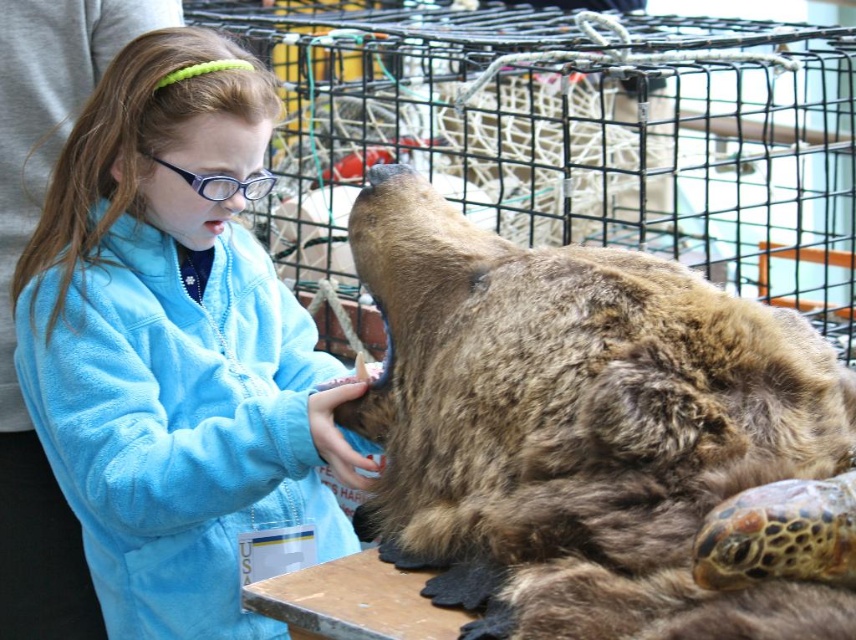
Identify the location of brown furry bear at center. The image size is (856, 640). (586, 420).

Does brown furry bear at center have a greater width compared to blue fleece jacket at upper left?

Yes.

Who is more forward, (714, 308) or (206, 588)?

Positioned in front is point (714, 308).

Locate an element on the screen. brown furry bear at center is located at coordinates (586, 420).